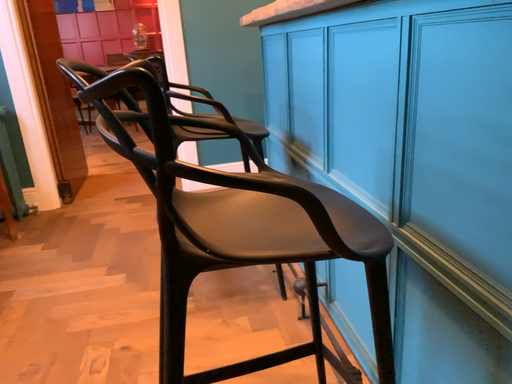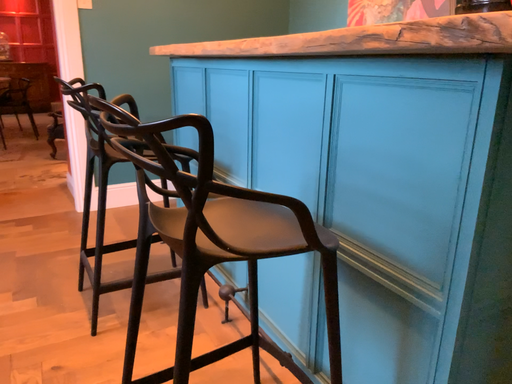
Question: Which way did the camera rotate in the video?

Choices:
 (A) rotated right
 (B) rotated left

Answer: (A)